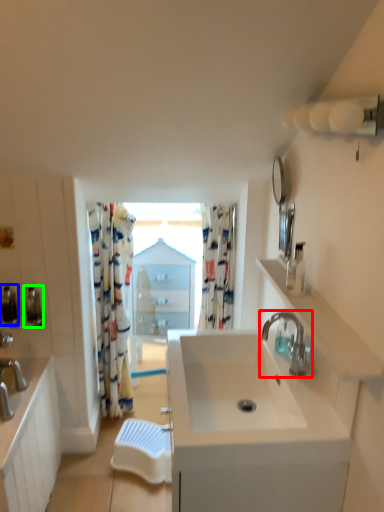
Question: Which is farther away from tap (highlighted by a red box)? soap dispenser (highlighted by a blue box) or soap dispenser (highlighted by a green box)?

Choices:
 (A) soap dispenser
 (B) soap dispenser

Answer: (A)